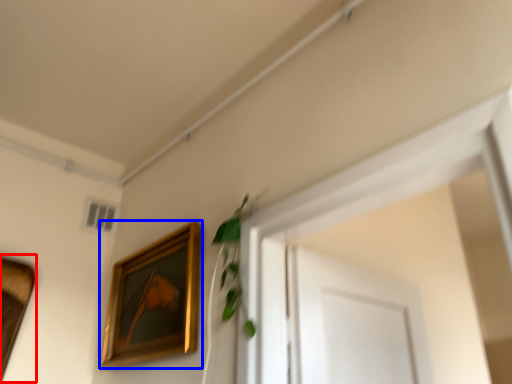
Question: Which object is further to the camera taking this photo, picture frame (highlighted by a red box) or picture frame (highlighted by a blue box)?

Choices:
 (A) picture frame
 (B) picture frame

Answer: (A)